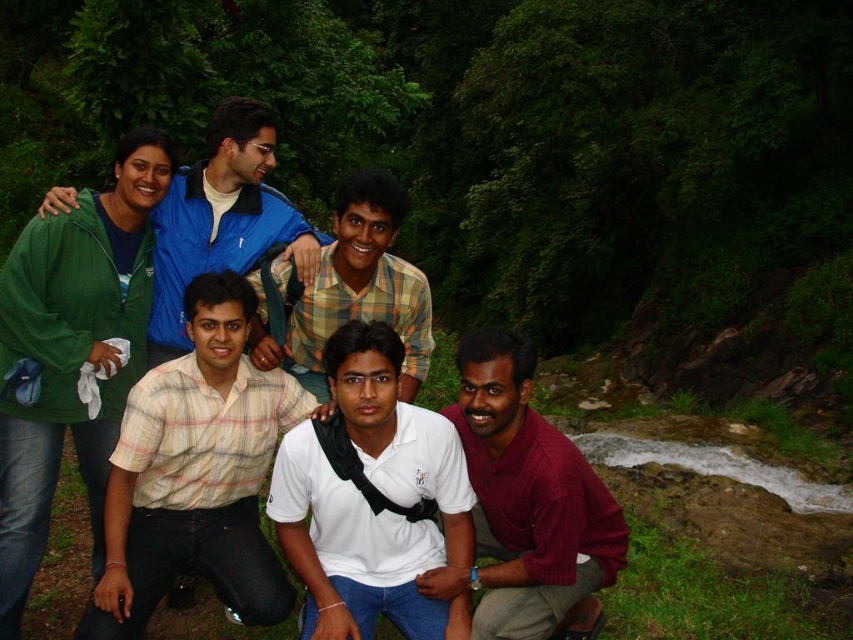
Can you confirm if yellow plaid shirt at center is wider than white matte shirt at center?

Indeed, yellow plaid shirt at center has a greater width compared to white matte shirt at center.

Which of these two, yellow plaid shirt at center or white matte shirt at center, stands taller?

Standing taller between the two is yellow plaid shirt at center.

Is point (206, 301) positioned after point (373, 404)?

Yes, point (206, 301) is behind point (373, 404).

Where is `yellow plaid shirt at center`? Image resolution: width=853 pixels, height=640 pixels. yellow plaid shirt at center is located at coordinates point(196,474).

Does yellow plaid shirt at center have a larger size compared to green fabric jacket at upper left?

Yes.

Does point (209, 426) come closer to viewer compared to point (222, 253)?

Yes, it is in front of point (222, 253).

Is point (149, 566) closer to camera compared to point (206, 202)?

Yes, it is.

Identify the location of yellow plaid shirt at center. The width and height of the screenshot is (853, 640). point(196,474).

Can you confirm if yellow plaid shirt at center is wider than green fleece jacket at upper left?

Indeed, yellow plaid shirt at center has a greater width compared to green fleece jacket at upper left.

Who is higher up, yellow plaid shirt at center or green fleece jacket at upper left?

green fleece jacket at upper left

Does point (167, 488) come behind point (9, 509)?

Yes, point (167, 488) is behind point (9, 509).

I want to click on yellow plaid shirt at center, so click(196, 474).